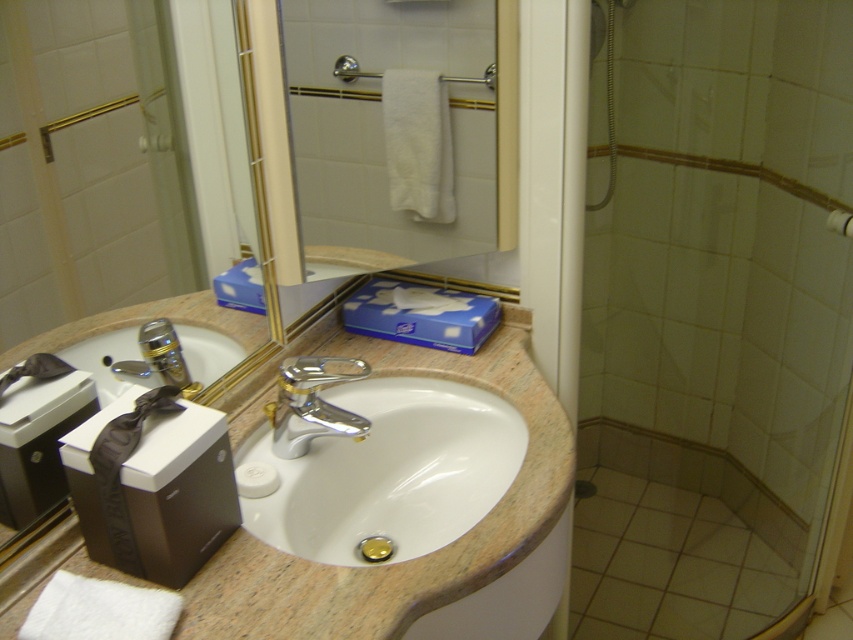
You are a hotel guest who wants to place a small decorative box on the bathroom countertop. The decorative box is 10 cm wide. The sink and faucet are in the way. Which object, the white glossy sink at center or the polished chrome faucet at center, has a wider base to avoid placing the box too close to it?

The white glossy sink at center has a wider base than the polished chrome faucet at center, so you should avoid placing the box too close to the sink to prevent blocking it.

You are standing in the bathroom and want to reach the matte black toiletries at left without touching the transparent glass shower door at right. Is this possible?

The transparent glass shower door at right is further to the viewer than matte black toiletries at left, so you can reach the matte black toiletries at left without touching the shower door since it is closer to you.

You are standing in the bathroom and want to touch both the white glossy sink at center and the polished chrome faucet at center. Which object will your hand reach first?

The white glossy sink at center is closer to the viewer than the polished chrome faucet at center, so you will reach the white glossy sink at center first.